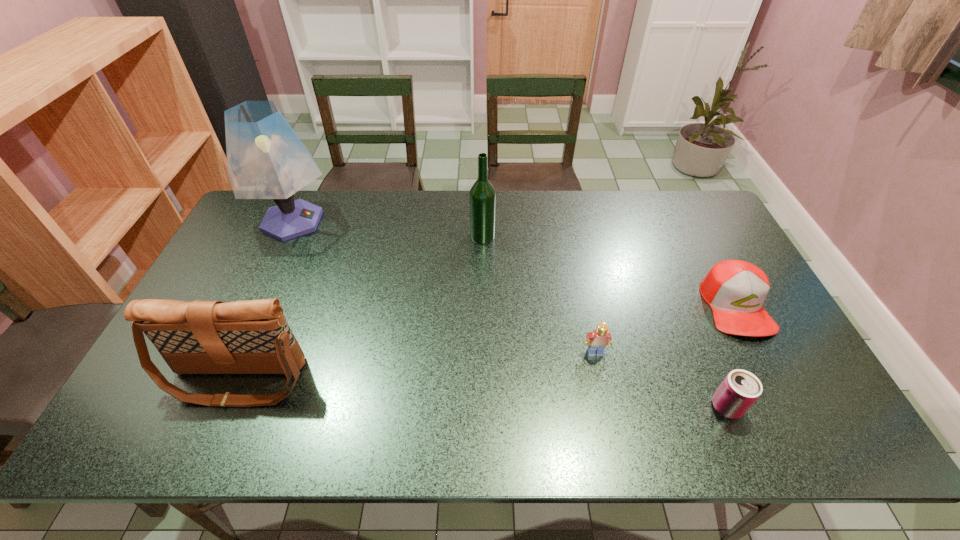
Locate an element on the screen. The image size is (960, 540). free spot between the rightmost object and the fourth shortest object is located at coordinates (487, 343).

At what (x,y) coordinates should I click in order to perform the action: click on empty space between the shoulder bag and the Lego. Please return your answer as a coordinate pair (x, y). Looking at the image, I should click on (417, 366).

At what (x,y) coordinates should I click in order to perform the action: click on free space between the third object from left to right and the third farthest object. Please return your answer as a coordinate pair (x, y). This screenshot has width=960, height=540. Looking at the image, I should click on (609, 271).

At what (x,y) coordinates should I click in order to perform the action: click on vacant area that lies between the Lego and the fifth object from left to right. Please return your answer as a coordinate pair (x, y). The width and height of the screenshot is (960, 540). Looking at the image, I should click on point(660,380).

This screenshot has height=540, width=960. Identify the location of object that is the second closest to the lampshade. (482, 197).

Find the location of `object that can be found as the fifth closest to the tallest object`. object that can be found as the fifth closest to the tallest object is located at coordinates (740, 389).

Identify the location of free point that satisfies the following two spatial constraints: 1. on the base of the fifth shortest object; 2. on the left side of the tallest object. (285, 237).

In order to click on vacant space that satisfies the following two spatial constraints: 1. on the base of the lampshade; 2. on the left side of the fifth shortest object in this screenshot , I will do coord(285,237).